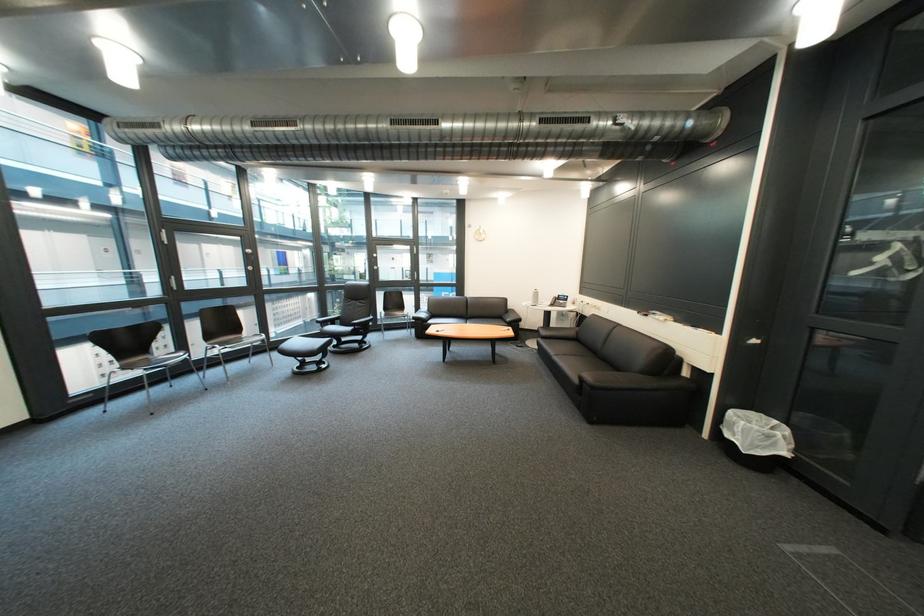
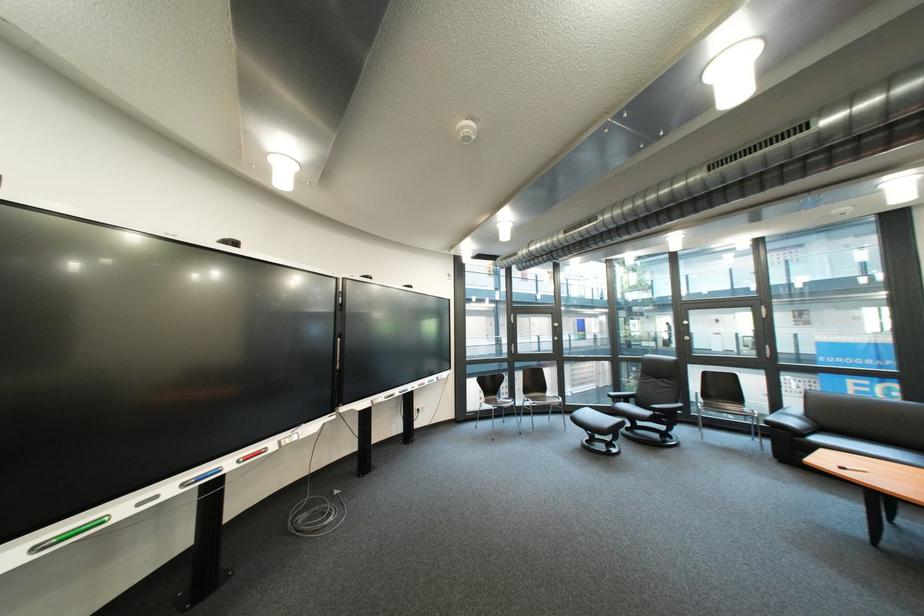
The point at (370, 329) is marked in the first image. Where is the corresponding point in the second image?

(670, 415)